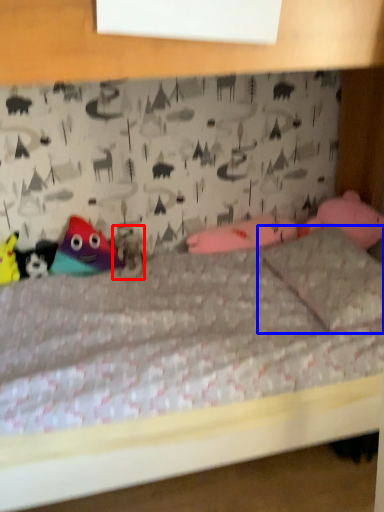
Question: Among these objects, which one is nearest to the camera, animal (highlighted by a red box) or pillow (highlighted by a blue box)?

Choices:
 (A) animal
 (B) pillow

Answer: (B)